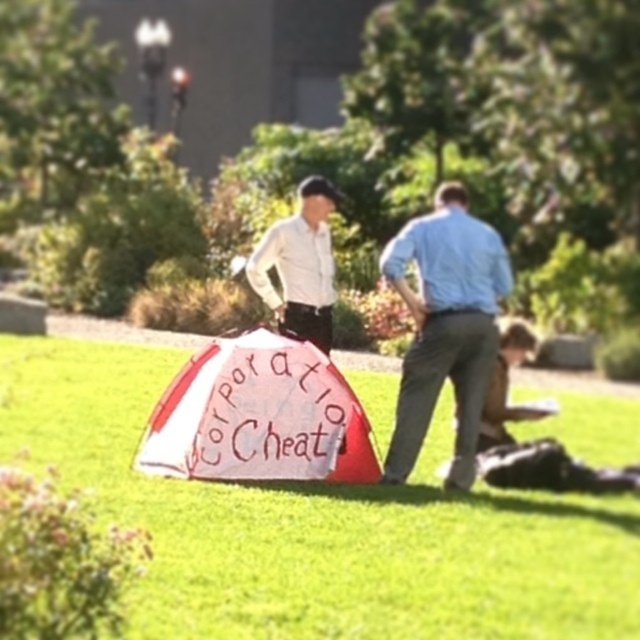
Question: Does green grass at center appear on the left side of white glossy shirt at center?

Choices:
 (A) yes
 (B) no

Answer: (A)

Question: Can you confirm if green grass at center is wider than light blue cotton shirt at right?

Choices:
 (A) yes
 (B) no

Answer: (A)

Question: Which of these objects is positioned closest to the white glossy shirt at center?

Choices:
 (A) light blue cotton shirt at right
 (B) green grass at center

Answer: (A)

Question: Which object appears farthest from the camera in this image?

Choices:
 (A) light blue cotton shirt at right
 (B) white glossy shirt at center
 (C) green grass at center

Answer: (B)

Question: Is green grass at center closer to camera compared to white glossy shirt at center?

Choices:
 (A) no
 (B) yes

Answer: (B)

Question: Which point is farther from the camera taking this photo?

Choices:
 (A) (35, 394)
 (B) (284, 269)
 (C) (490, 253)

Answer: (A)